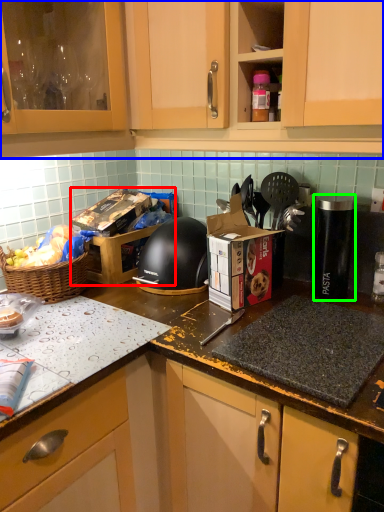
Question: Which object is positioned farthest from cardboard box (highlighted by a red box)? Select from cabinetry (highlighted by a blue box) and appliance (highlighted by a green box).

Choices:
 (A) cabinetry
 (B) appliance

Answer: (B)